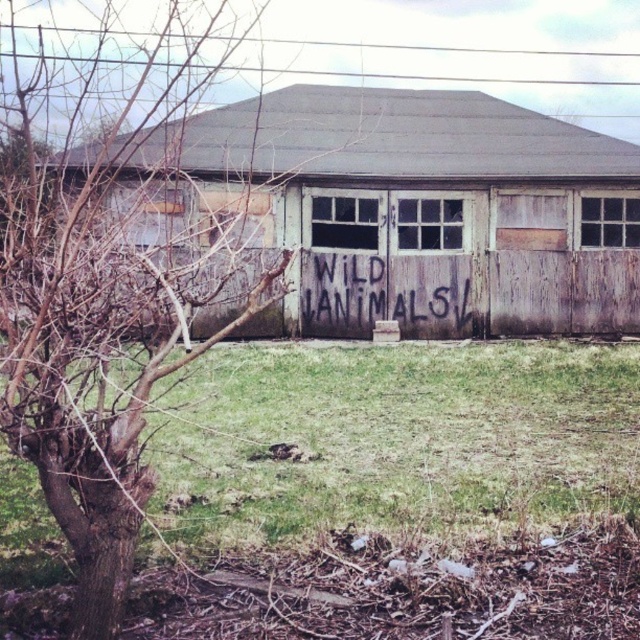
Question: Does weathered wood shed at center appear on the left side of green grass at lower center?

Choices:
 (A) yes
 (B) no

Answer: (A)

Question: Which point is closer to the camera?

Choices:
 (A) (353, 304)
 (B) (221, 259)

Answer: (B)

Question: Which object is closer to the camera taking this photo?

Choices:
 (A) grungy wood sign at center
 (B) weathered wood shed at center

Answer: (B)

Question: Considering the real-world distances, which object is closest to the green grass at lower center?

Choices:
 (A) grungy wood sign at center
 (B) weathered wood shed at center

Answer: (B)

Question: Can you confirm if weathered wood shed at center is wider than green grass at lower center?

Choices:
 (A) yes
 (B) no

Answer: (A)

Question: Does weathered wood shed at center appear under bare wood tree at left?

Choices:
 (A) no
 (B) yes

Answer: (B)